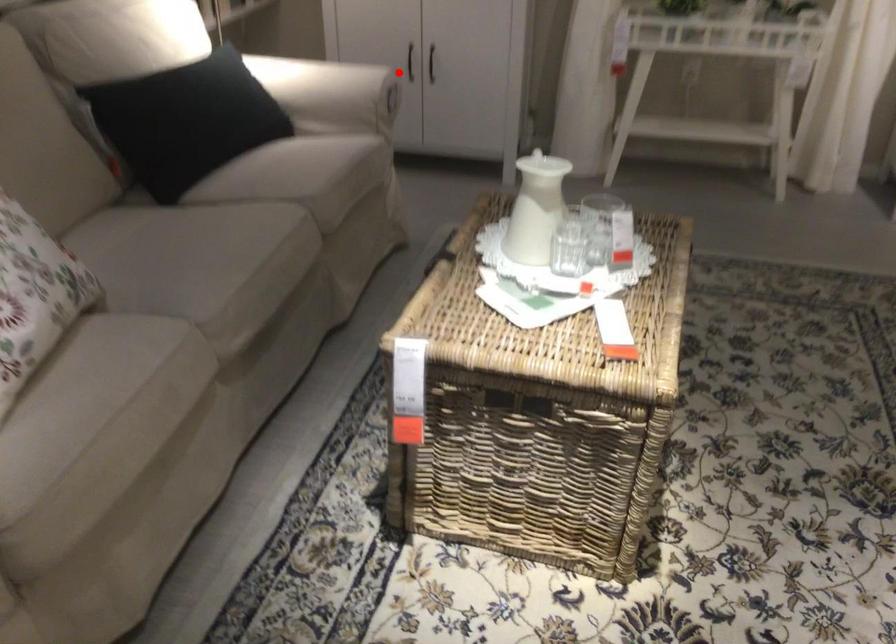
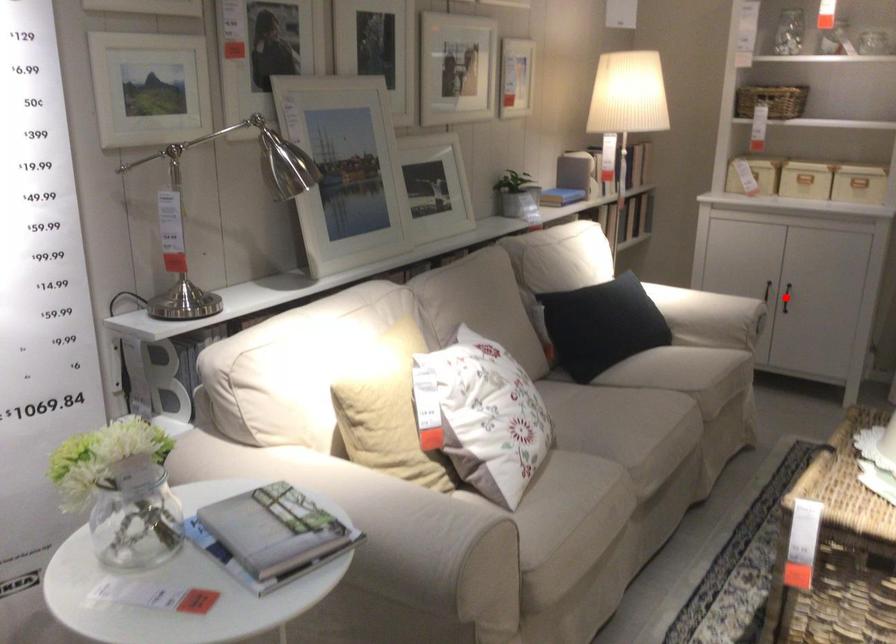
Consider the image. I am providing you with two images of the same scene from different viewpoints. A red point is marked on the first image and another point is marked on the second image. Is the red point in image1 aligned with the point shown in image2?

No